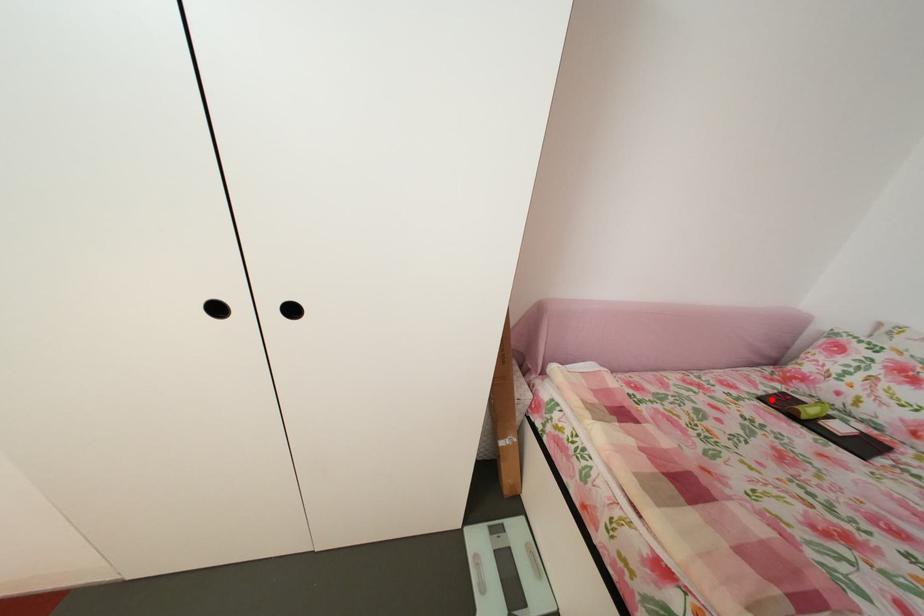
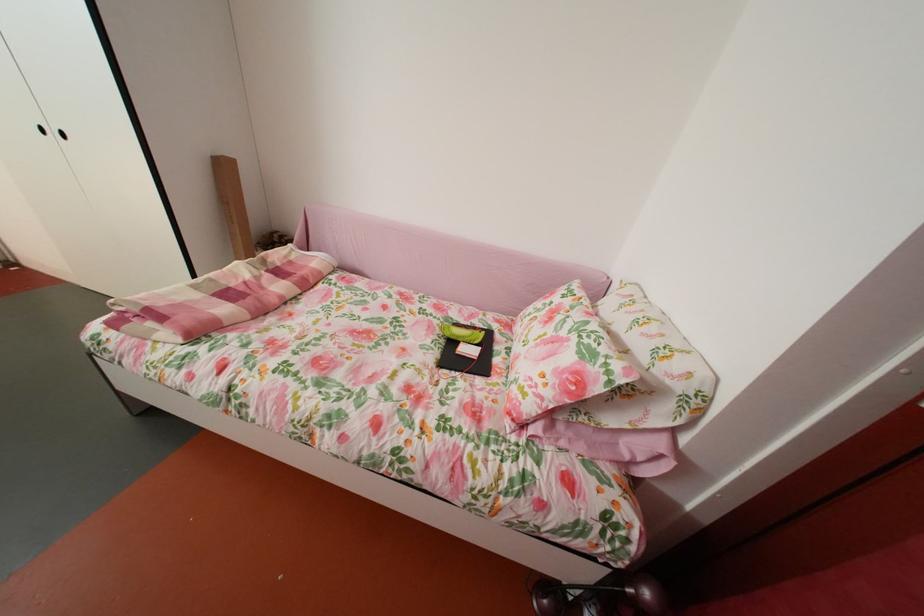
Where in the second image is the point corresponding to the highlighted location from the first image?

(473, 328)